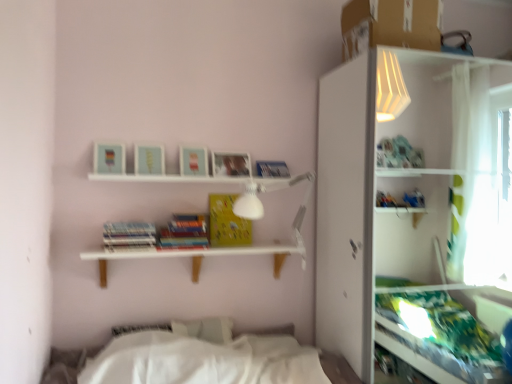
Question: Considering the positions of hardcover book at center, arranged as the 2th paperback book when viewed from the left, and hardcover books at center, the 3th paperback book in the right-to-left sequence, in the image, is hardcover book at center, arranged as the 2th paperback book when viewed from the left, wider or thinner than hardcover books at center, the 3th paperback book in the right-to-left sequence,?

Choices:
 (A) wide
 (B) thin

Answer: (B)

Question: Is hardcover book at center, which is counted as the second paperback book, starting from the right, situated inside hardcover books at center, positioned as the 1th paperback book in left-to-right order, or outside?

Choices:
 (A) inside
 (B) outside

Answer: (B)

Question: Which object is the farthest from the hardcover books at center, the 3th paperback book in the right-to-left sequence?

Choices:
 (A) hardcover book at center, which is counted as the second paperback book, starting from the right
 (B) white matte shelf at center
 (C) white glossy shelf at upper right
 (D) yellow matte paper at center, arranged as the third paperback book when viewed from the left

Answer: (C)

Question: Which is farther from the yellow matte paper at center, arranged as the 1th paperback book when viewed from the right?

Choices:
 (A) hardcover books at center, the 3th paperback book in the right-to-left sequence
 (B) white glossy shelf at upper right
 (C) white matte shelf at center
 (D) hardcover book at center, which is counted as the second paperback book, starting from the right

Answer: (B)